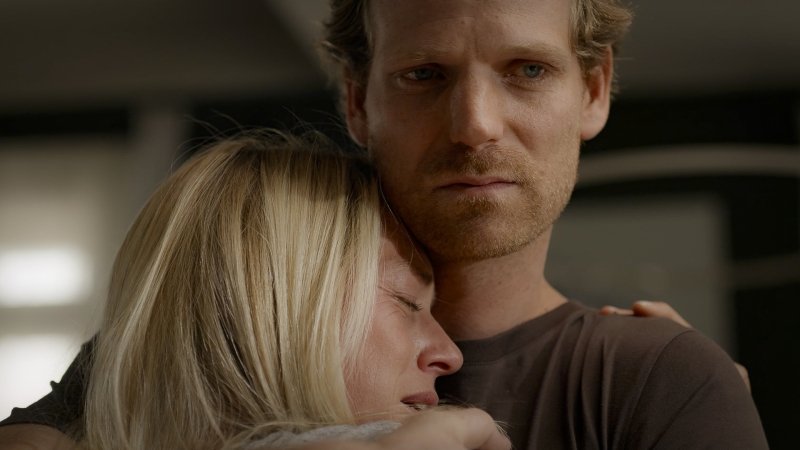
This screenshot has width=800, height=450. Find the location of `window`. window is located at coordinates (38, 345).